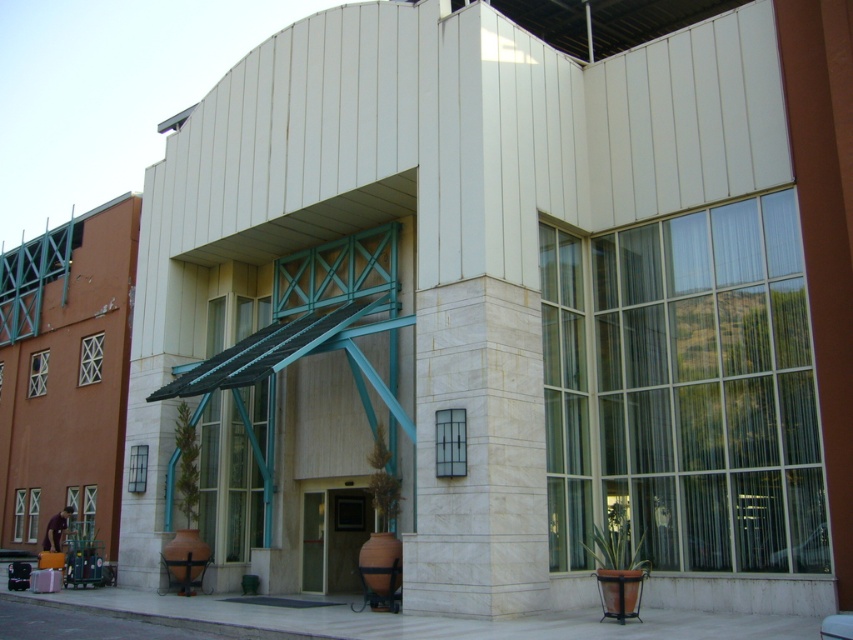
You are a delivery person approaching the entrance of the building. You need to deliver a package to the office behind the metallic door at center. However, there is a white marble pillar at center in your path. Can you walk around the pillar to reach the door?

The white marble pillar at center is in front of the metallic door at center, so you can walk around the pillar to reach the door.

You are standing in front of the building and want to enter through the metallic door at center. There is a white marble pillar at center in the way. Can you walk around it to reach the door?

The white marble pillar at center is positioned on the right side of the metallic door at center, so you can walk around it on the left side to reach the door.

You are standing in front of the modern building and notice two points on the facade. The first point is at coordinate point (444, 484) and the second is at point (315, 570). Which point is closer to you?

Point (444, 484) is closer to the camera than point (315, 570).